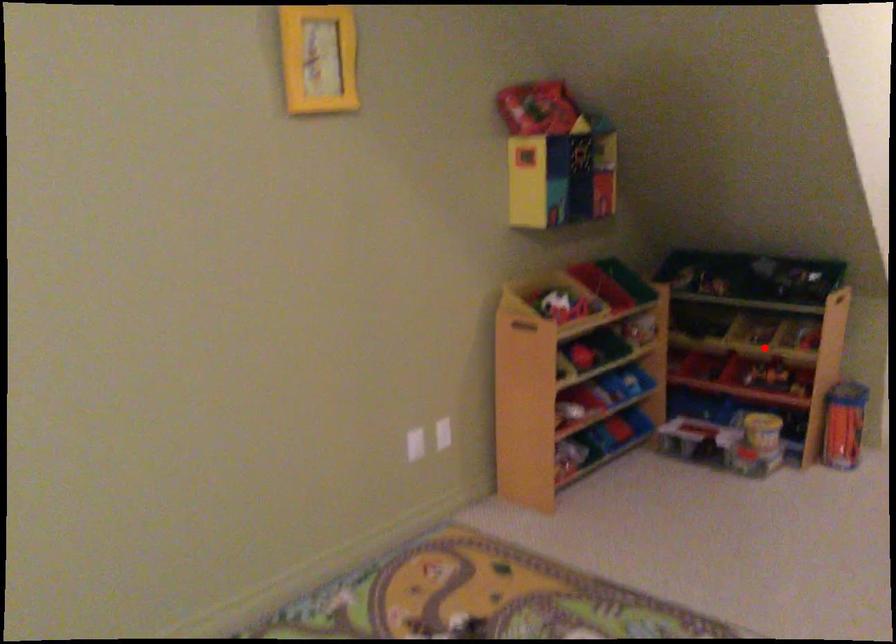
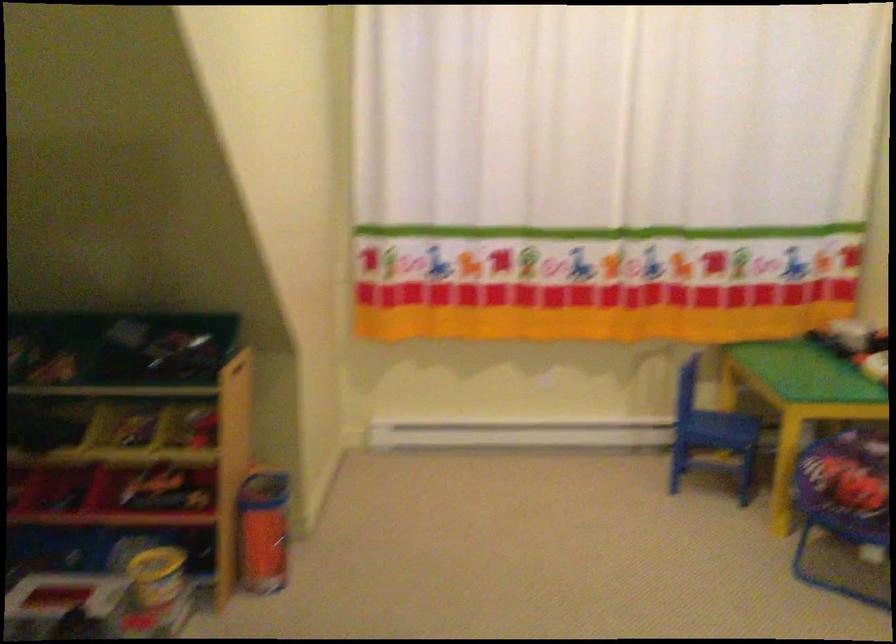
Question: I am providing you with two images of the same scene from different viewpoints. Given a red point in image1, look at the same physical point in image2. Is it:

Choices:
 (A) Closer to the viewpoint
 (B) Farther from the viewpoint

Answer: (A)